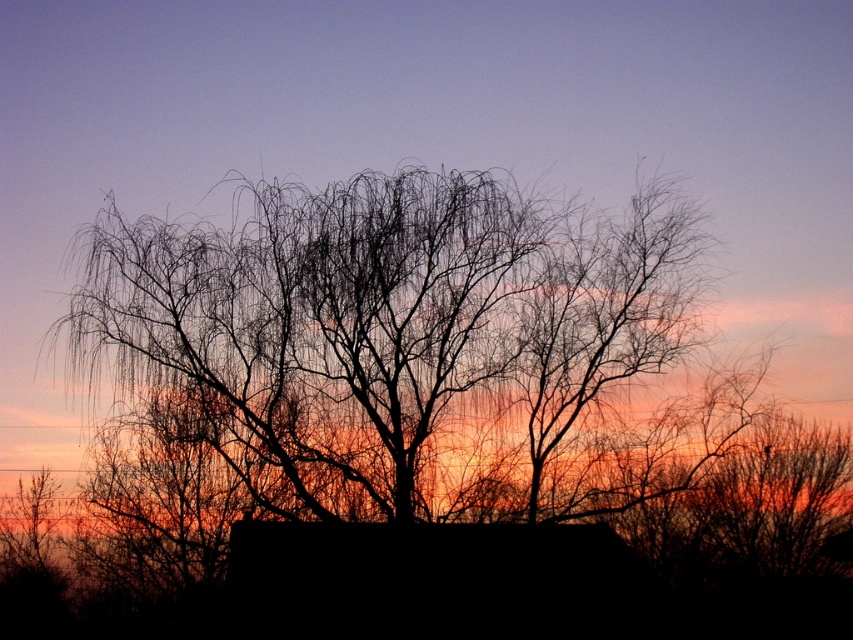
You are an artist planning to paint the sunset scene. You want to ensure the proportions of the silhouette branches at center and the black matte hut at center are accurate. Which object should you draw first to maintain proper scaling?

The silhouette branches at center is taller than the black matte hut at center, so you should draw the silhouette branches at center first to ensure the black matte hut at center is proportionally smaller in height.

You are standing in the middle of the scene and want to walk towards the black matte hut at center. Which direction should you move to avoid the silhouette branches at center?

The silhouette branches at center are closer to you than the black matte hut at center. To avoid them, move sideways either to the left or right while walking towards the black matte hut at center.